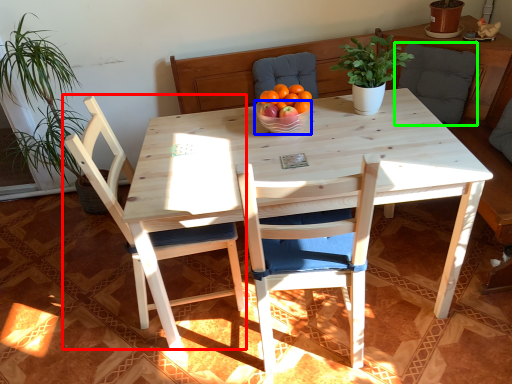
Question: Estimate the real-world distances between objects in this image. Which object is closer to chair (highlighted by a red box), bowl (highlighted by a blue box) or armchair (highlighted by a green box)?

Choices:
 (A) bowl
 (B) armchair

Answer: (A)